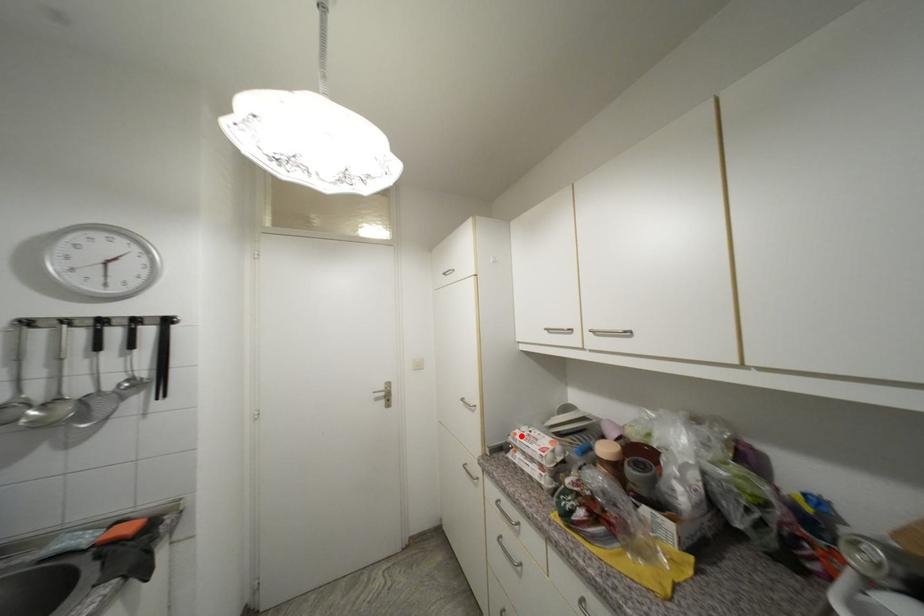
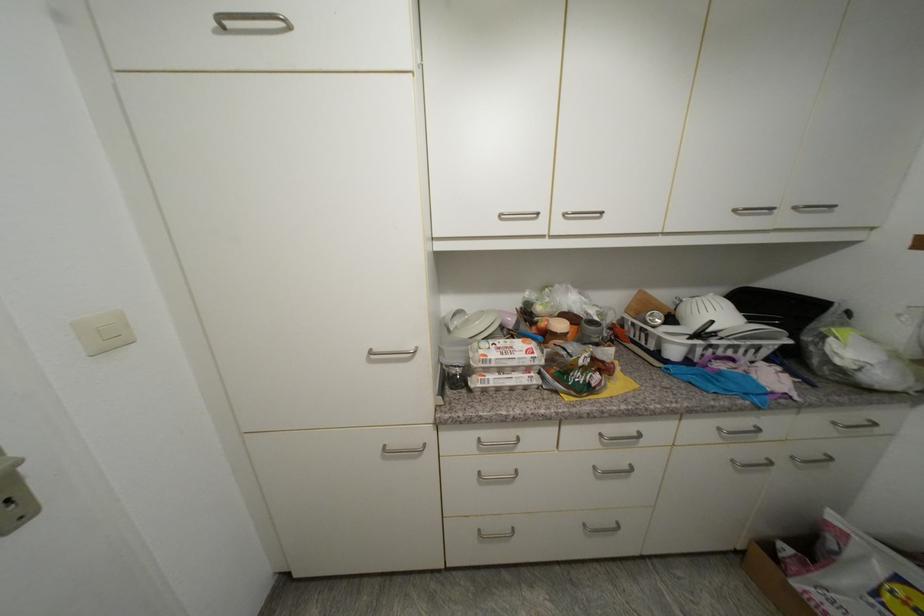
Find the pixel in the second image that matches the highlighted location in the first image.

(492, 357)